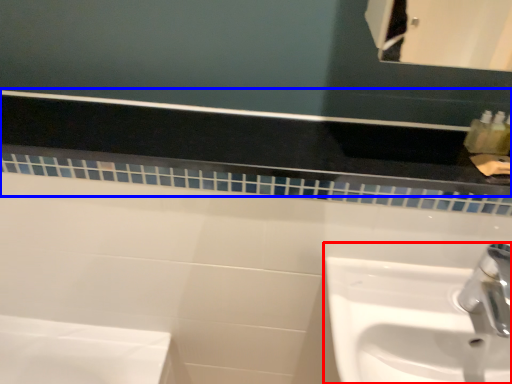
Question: Which object is closer to the camera taking this photo, sink (highlighted by a red box) or balustrade (highlighted by a blue box)?

Choices:
 (A) sink
 (B) balustrade

Answer: (A)